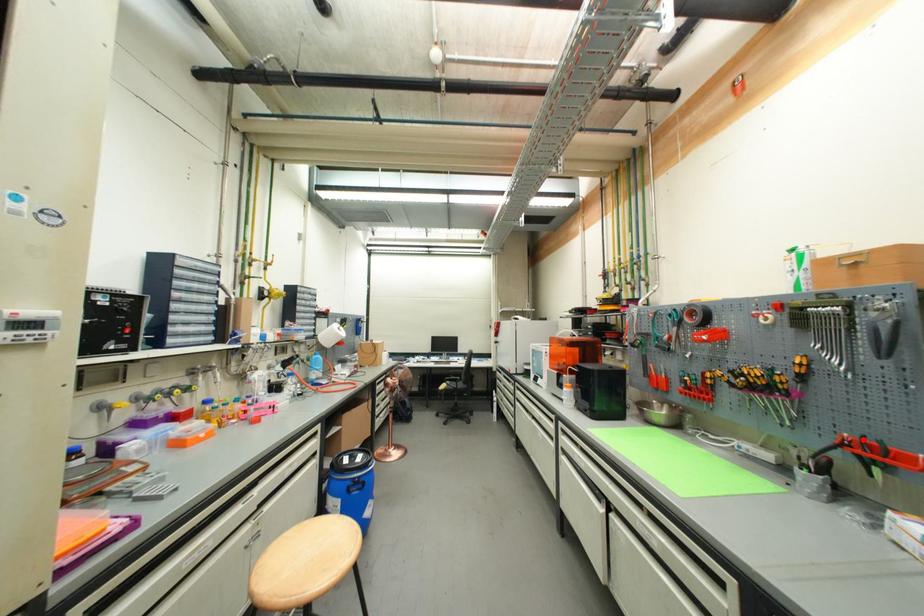
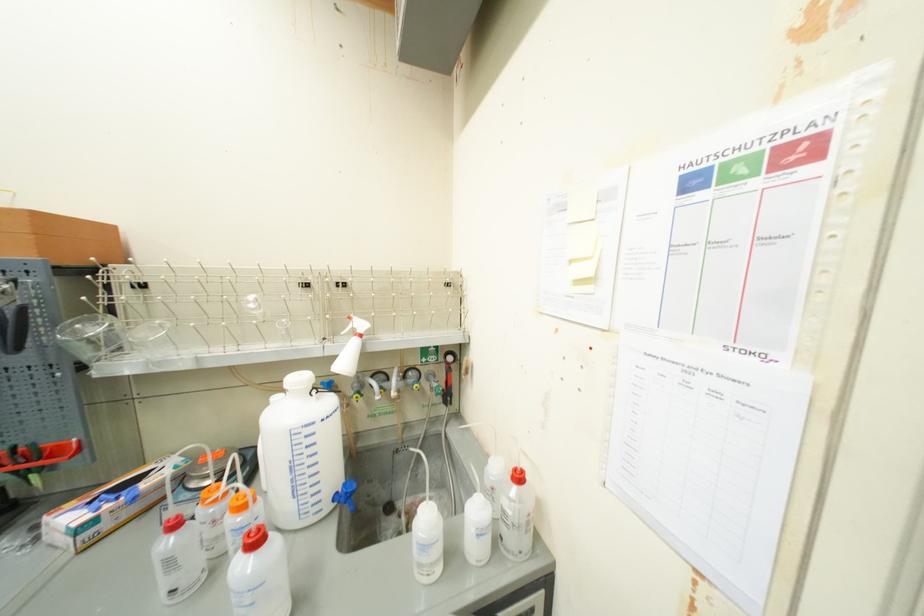
Question: I am providing you with two images of the same scene from different viewpoints. Image1 has a red point marked. In image2, the corresponding 3D location appears at what relative position? Reply with the corresponding letter.

Choices:
 (A) Closer
 (B) Farther

Answer: (A)